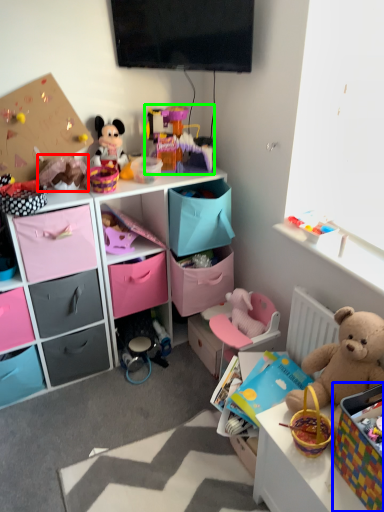
Question: Considering the real-world distances, which object is closest to toy (highlighted by a red box)? storage box (highlighted by a blue box) or toy (highlighted by a green box).

Choices:
 (A) storage box
 (B) toy

Answer: (B)